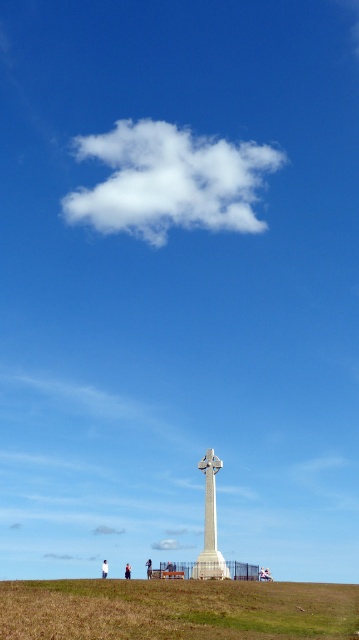
Can you confirm if white stone monument at center is bigger than white cotton shirt at center?

Correct, white stone monument at center is larger in size than white cotton shirt at center.

At what (x,y) coordinates should I click in order to perform the action: click on white stone monument at center. Please return your answer as a coordinate pair (x, y). Image resolution: width=359 pixels, height=640 pixels. Looking at the image, I should click on (210, 524).

Find the location of a particular element. white stone monument at center is located at coordinates (210, 524).

Image resolution: width=359 pixels, height=640 pixels. What do you see at coordinates (210, 461) in the screenshot?
I see `white stone cross at center` at bounding box center [210, 461].

Who is more distant from viewer, (210,449) or (147,566)?

The point (147,566) is more distant.

Find the location of a particular element. The height and width of the screenshot is (640, 359). white stone cross at center is located at coordinates (210, 461).

Between white stone cross at center and reddish-brown fabric at center, which one appears on the left side from the viewer's perspective?

reddish-brown fabric at center

Which is below, white stone cross at center or reddish-brown fabric at center?

reddish-brown fabric at center is below.

Between point (220, 461) and point (124, 570), which one is positioned in front?

Positioned in front is point (220, 461).

At what (x,y) coordinates should I click in order to perform the action: click on white stone cross at center. Please return your answer as a coordinate pair (x, y). Looking at the image, I should click on (210, 461).